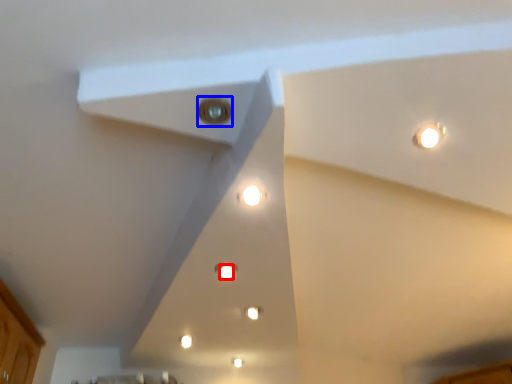
Question: Which of the following is the farthest to the observer, light (highlighted by a red box) or light (highlighted by a blue box)?

Choices:
 (A) light
 (B) light

Answer: (A)